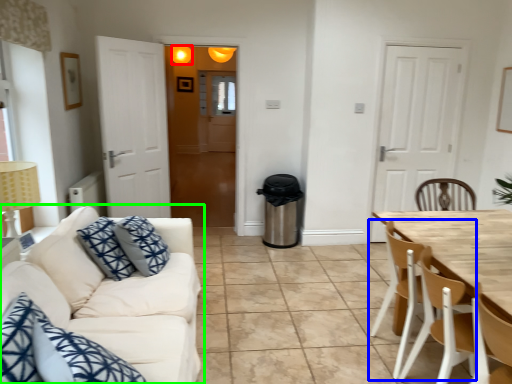
Question: Which is nearer to the light fixture (highlighted by a red box)? chair (highlighted by a blue box) or studio couch (highlighted by a green box).

Choices:
 (A) chair
 (B) studio couch

Answer: (B)